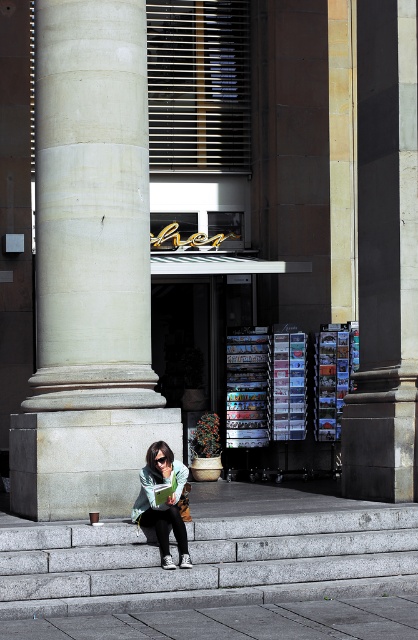
You are standing in front of the classical building and want to place a small plant pot between the gray concrete stairs at lower left and the green fabric scarf at lower center. Based on their positions, which object should the plant pot be closer to?

The gray concrete stairs at lower left is closer to the viewer than the green fabric scarf at lower center, so the plant pot should be placed closer to the green fabric scarf at lower center to maintain visual balance between the two objects.

You are a delivery person with a cart that is 2.5 meters wide. You need to navigate through the space between the white marble column at center and the gray concrete stairs at lower left. Can your cart fit through this space?

The distance between the white marble column at center and the gray concrete stairs at lower left is 2.44 meters, which is narrower than the cart width of 2.5 meters. Therefore, the cart cannot fit through the space between them.

What is the 2D coordinate of the white marble column at center in the image?

The white marble column at center is located at the 2D coordinate point of (91, 209).